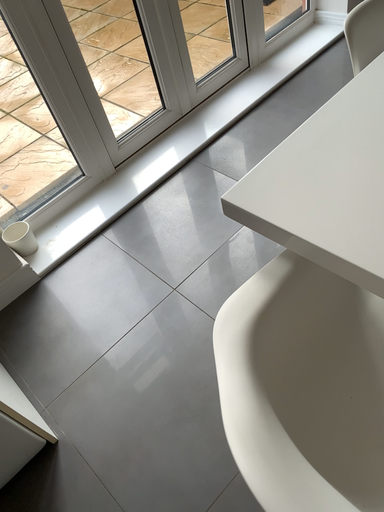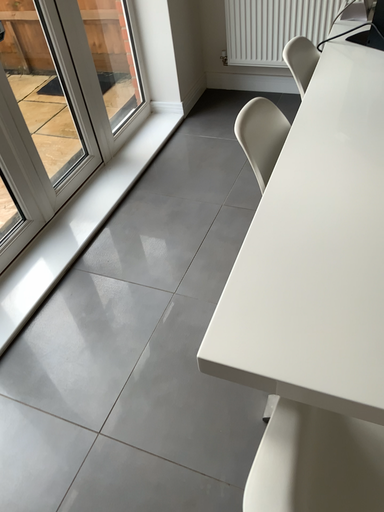
Question: How did the camera likely rotate when shooting the video?

Choices:
 (A) rotated downward
 (B) rotated upward

Answer: (B)